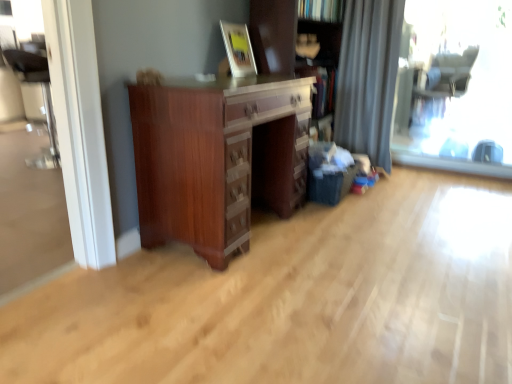
Question: Is point (485, 8) positioned closer to the camera than point (386, 96)?

Choices:
 (A) farther
 (B) closer

Answer: (A)

Question: In the image, is transparent glass window at right positioned in front of or behind gray fabric curtain at right?

Choices:
 (A) behind
 (B) front

Answer: (B)

Question: Estimate the real-world distances between objects in this image. Which object is farther from the mahogany wood chest of drawers at center?

Choices:
 (A) transparent glass window at right
 (B) gray fabric curtain at right
 (C) wooden bookcase at center
 (D) wooden picture frame at upper center

Answer: (A)

Question: Estimate the real-world distances between objects in this image. Which object is closer to the mahogany wood chest of drawers at center?

Choices:
 (A) wooden picture frame at upper center
 (B) transparent glass window at right
 (C) wooden bookcase at center
 (D) gray fabric curtain at right

Answer: (A)